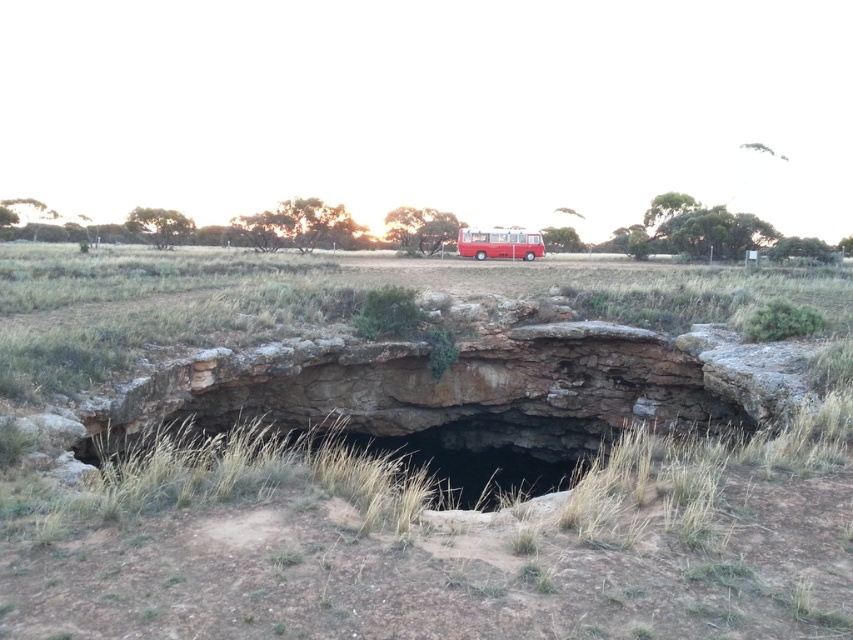
Who is positioned more to the right, dry grass at center or matte red bus at center?

matte red bus at center is more to the right.

Is point (200, 557) more distant than point (485, 252)?

No, it is in front of (485, 252).

Locate an element on the screen. dry grass at center is located at coordinates (440, 476).